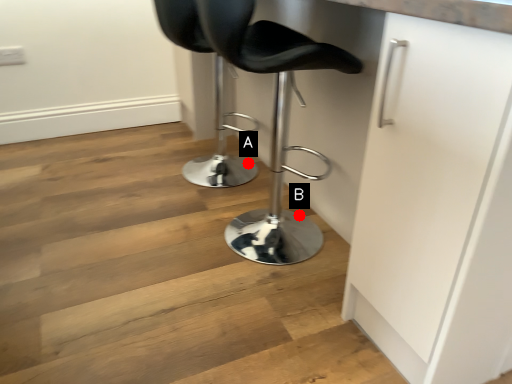
Question: Two points are circled on the image, labeled by A and B beside each circle. Which point is closer to the camera taking this photo?

Choices:
 (A) A is closer
 (B) B is closer

Answer: (B)